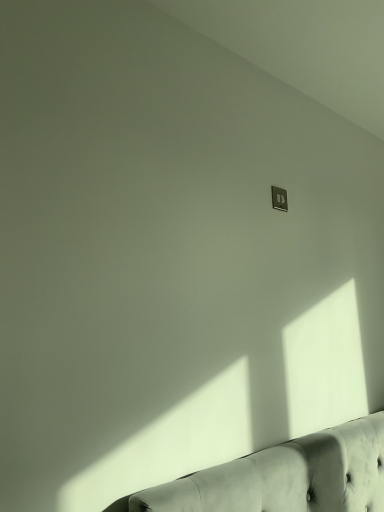
Question: In the image, is tufted leather couch at lower right on the left side or the right side of metallic silver outlet at upper right?

Choices:
 (A) left
 (B) right

Answer: (B)

Question: Looking at the image, does tufted leather couch at lower right seem bigger or smaller compared to metallic silver outlet at upper right?

Choices:
 (A) big
 (B) small

Answer: (A)

Question: Is tufted leather couch at lower right taller or shorter than metallic silver outlet at upper right?

Choices:
 (A) short
 (B) tall

Answer: (A)

Question: In the image, is metallic silver outlet at upper right positioned in front of or behind tufted leather couch at lower right?

Choices:
 (A) front
 (B) behind

Answer: (B)

Question: In the image, is metallic silver outlet at upper right on the left side or the right side of tufted leather couch at lower right?

Choices:
 (A) right
 (B) left

Answer: (B)

Question: Considering the positions of metallic silver outlet at upper right and tufted leather couch at lower right in the image, is metallic silver outlet at upper right taller or shorter than tufted leather couch at lower right?

Choices:
 (A) short
 (B) tall

Answer: (B)

Question: Considering the positions of metallic silver outlet at upper right and tufted leather couch at lower right in the image, is metallic silver outlet at upper right bigger or smaller than tufted leather couch at lower right?

Choices:
 (A) small
 (B) big

Answer: (A)